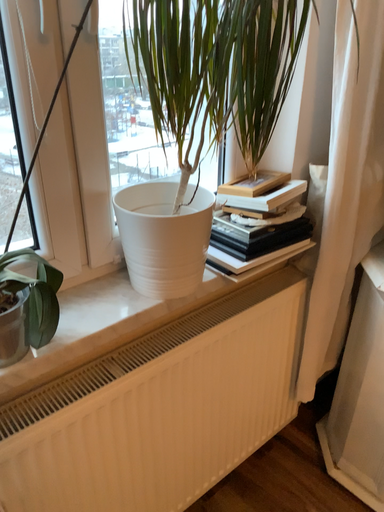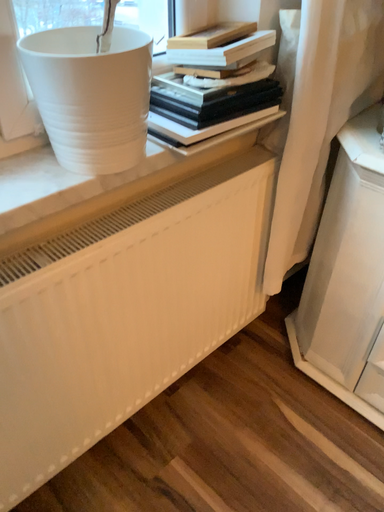
Question: Which way did the camera rotate in the video?

Choices:
 (A) rotated upward
 (B) rotated downward

Answer: (B)